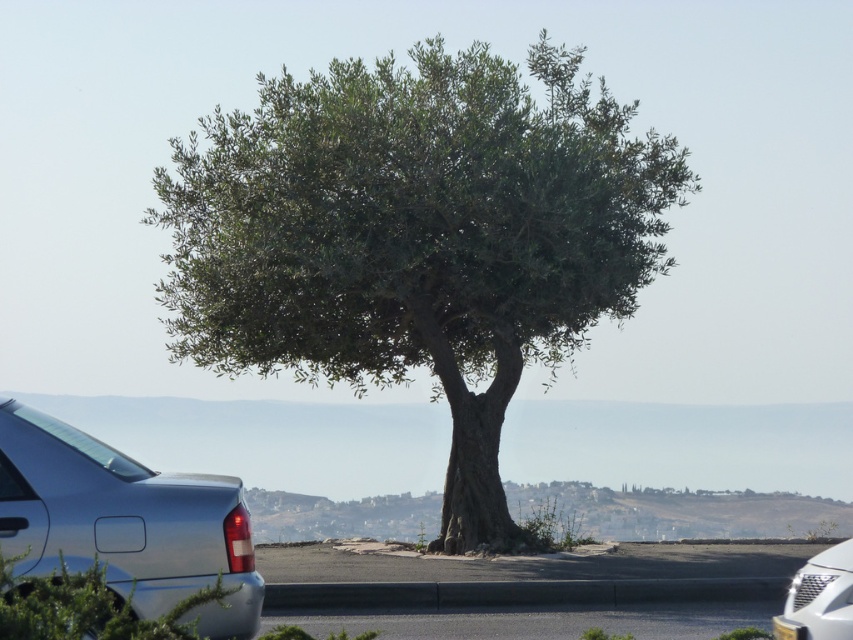
What do you see at coordinates (125, 522) in the screenshot? I see `satin metallic car at lower left` at bounding box center [125, 522].

I want to click on satin metallic car at lower left, so click(x=125, y=522).

Locate an element on the screen. Image resolution: width=853 pixels, height=640 pixels. satin metallic car at lower left is located at coordinates (125, 522).

Which is below, green leafy tree at center or satin metallic car at lower left?

satin metallic car at lower left is lower down.

Does green leafy tree at center have a lesser height compared to satin metallic car at lower left?

No.

Image resolution: width=853 pixels, height=640 pixels. I want to click on green leafy tree at center, so click(416, 237).

Find the location of a particular element. Image resolution: width=853 pixels, height=640 pixels. green leafy tree at center is located at coordinates (416, 237).

The height and width of the screenshot is (640, 853). Describe the element at coordinates (416, 237) in the screenshot. I see `green leafy tree at center` at that location.

The width and height of the screenshot is (853, 640). I want to click on green leafy tree at center, so click(416, 237).

You are a GUI agent. You are given a task and a screenshot of the screen. Output one action in this format:
    pyautogui.click(x=<x>, y=<y>)
    Task: Click on the green leafy tree at center
    
    Given the screenshot: What is the action you would take?
    pyautogui.click(x=416, y=237)